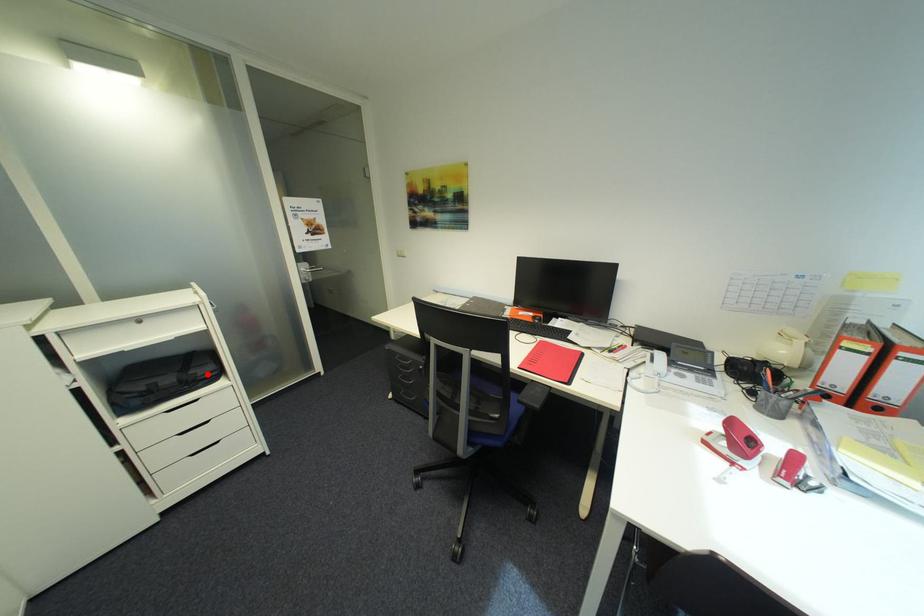
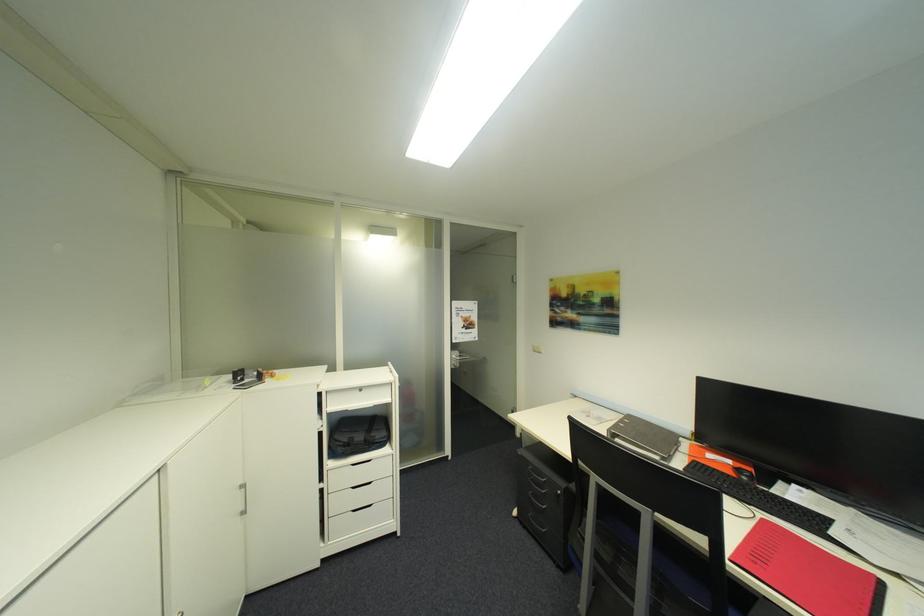
In the second image, find the point that corresponds to the highlighted location in the first image.

(384, 438)